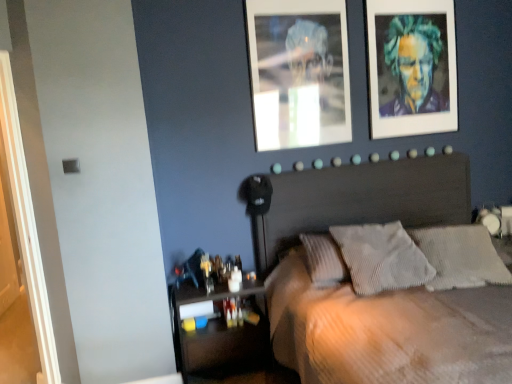
The width and height of the screenshot is (512, 384). Describe the element at coordinates (413, 65) in the screenshot. I see `multicolored textured portrait at upper right` at that location.

Describe the element at coordinates (461, 257) in the screenshot. I see `gray corduroy pillow at center, which is the 2th pillow from left to right` at that location.

Where is `translucent plastic shelf at lower left`? This screenshot has height=384, width=512. translucent plastic shelf at lower left is located at coordinates pos(218,331).

From a real-world perspective, relative to metallic silver photo frame at upper center, is wooden bed at center vertically above or below?

In terms of real-world spatial position, wooden bed at center is below metallic silver photo frame at upper center.

Does wooden bed at center have a greater width compared to metallic silver photo frame at upper center?

Yes, wooden bed at center is wider than metallic silver photo frame at upper center.

Consider the image. Considering the sizes of wooden bed at center and metallic silver photo frame at upper center in the image, is wooden bed at center taller or shorter than metallic silver photo frame at upper center?

Considering their sizes, wooden bed at center has more height than metallic silver photo frame at upper center.

The width and height of the screenshot is (512, 384). I want to click on bed on the right side of metallic silver photo frame at upper center, so click(x=384, y=333).

Does multicolored textured portrait at upper right turn towards white painted wood door at left?

No, multicolored textured portrait at upper right is not aimed at white painted wood door at left.

How many degrees apart are the facing directions of multicolored textured portrait at upper right and white painted wood door at left?

They differ by 45.5 degrees in their facing directions.

From a real-world perspective, who is located higher, multicolored textured portrait at upper right or white painted wood door at left?

multicolored textured portrait at upper right.

From the image's perspective, does multicolored textured portrait at upper right appear higher than white painted wood door at left?

Yes.

How much distance is there between multicolored textured portrait at upper right and gray corduroy pillow at center, which is the 2th pillow from left to right?

3.86 feet.

Is multicolored textured portrait at upper right oriented towards gray corduroy pillow at center, which is the 1th pillow from right to left?

No, multicolored textured portrait at upper right is not aimed at gray corduroy pillow at center, which is the 1th pillow from right to left.

Is multicolored textured portrait at upper right placed right next to gray corduroy pillow at center, which is the 1th pillow from right to left?

No, multicolored textured portrait at upper right is not touching gray corduroy pillow at center, which is the 1th pillow from right to left.

Is multicolored textured portrait at upper right positioned behind gray corduroy pillow at center, which is the 2th pillow from left to right?

That is True.

Based on the photo, who is bigger, white painted wood door at left or metallic silver photo frame at upper center?

Bigger between the two is white painted wood door at left.

Looking at this image, measure the distance between white painted wood door at left and metallic silver photo frame at upper center.

A distance of 1.72 meters exists between white painted wood door at left and metallic silver photo frame at upper center.

Between white painted wood door at left and metallic silver photo frame at upper center, which one is positioned in front?

white painted wood door at left is closer to the camera.

Considering the relative sizes of white painted wood door at left and metallic silver photo frame at upper center in the image provided, is white painted wood door at left thinner than metallic silver photo frame at upper center?

No.

Where is `bed located on the right of translucent plastic shelf at lower left`? This screenshot has width=512, height=384. bed located on the right of translucent plastic shelf at lower left is located at coordinates (384, 333).

Does translucent plastic shelf at lower left have a lesser width compared to wooden bed at center?

Yes.

Can you tell me how much translucent plastic shelf at lower left and wooden bed at center differ in facing direction?

They differ by 0.298 degrees in their facing directions.

Between translucent plastic shelf at lower left and wooden bed at center, which one has smaller size?

translucent plastic shelf at lower left is smaller.

Is point (25, 268) positioned behind point (441, 286)?

Yes, it is behind point (441, 286).

Where is `the 2nd pillow counting from the right side of the white painted wood door at left`? The image size is (512, 384). the 2nd pillow counting from the right side of the white painted wood door at left is located at coordinates [x=461, y=257].

Which object is closer to the camera, white painted wood door at left or gray corduroy pillow at center, which is the 2th pillow from left to right?

white painted wood door at left is closer to the camera.

From a real-world perspective, does gray corduroy pillow at center, which is the 2th pillow from left to right, stand above white painted wood door at left?

Actually, gray corduroy pillow at center, which is the 2th pillow from left to right, is physically below white painted wood door at left in the real world.

Is gray corduroy pillow at center, which is the 2th pillow from left to right, wider than white painted wood door at left?

Correct, the width of gray corduroy pillow at center, which is the 2th pillow from left to right, exceeds that of white painted wood door at left.

Considering the relative sizes of gray corduroy pillow at center, which is the 2th pillow from left to right, and white painted wood door at left in the image provided, is gray corduroy pillow at center, which is the 2th pillow from left to right, smaller than white painted wood door at left?

Yes, gray corduroy pillow at center, which is the 2th pillow from left to right, is smaller than white painted wood door at left.

From the image's perspective, is gray corduroy pillow at center, which is the 1th pillow from right to left, positioned above or below white painted wood door at left?

Clearly, from the image's perspective, gray corduroy pillow at center, which is the 1th pillow from right to left, is below white painted wood door at left.

This screenshot has width=512, height=384. In order to click on bed below the metallic silver photo frame at upper center (from the image's perspective) in this screenshot , I will do `click(384, 333)`.

Find the location of a particular element. The height and width of the screenshot is (384, 512). door that appears on the left of multicolored textured portrait at upper right is located at coordinates (26, 224).

When comparing their distances from translucent plastic shelf at lower left, does white painted wood door at left or multicolored textured portrait at upper right seem further?

multicolored textured portrait at upper right.

Looking at this image, based on their spatial positions, is wooden bed at center or white painted wood door at left further from translucent plastic shelf at lower left?

white painted wood door at left lies further to translucent plastic shelf at lower left than the other object.

Which object lies further to the anchor point translucent plastic shelf at lower left, gray corduroy pillow at center, which is the 1th pillow from right to left, or gray corduroy pillow at center, which is the second pillow from right to left?

The object further to translucent plastic shelf at lower left is gray corduroy pillow at center, which is the 1th pillow from right to left.

Looking at the image, which one is located further to metallic silver photo frame at upper center, gray corduroy pillow at center, which ranks as the first pillow in left-to-right order, or white painted wood door at left?

white painted wood door at left lies further to metallic silver photo frame at upper center than the other object.

When comparing their distances from gray corduroy pillow at center, which is the second pillow from right to left, does white painted wood door at left or gray corduroy pillow at center, which is the 2th pillow from left to right, seem closer?

gray corduroy pillow at center, which is the 2th pillow from left to right, is positioned closer to the anchor gray corduroy pillow at center, which is the second pillow from right to left.

In the scene shown: From the image, which object appears to be farther from white painted wood door at left, wooden bed at center or gray corduroy pillow at center, which ranks as the first pillow in left-to-right order?

gray corduroy pillow at center, which ranks as the first pillow in left-to-right order, lies further to white painted wood door at left than the other object.

From the image, which object appears to be farther from metallic silver photo frame at upper center, wooden bed at center or white painted wood door at left?

Based on the image, white painted wood door at left appears to be further to metallic silver photo frame at upper center.

From the image, which object appears to be farther from white painted wood door at left, metallic silver photo frame at upper center or gray corduroy pillow at center, which is the 1th pillow from right to left?

Among the two, gray corduroy pillow at center, which is the 1th pillow from right to left, is located further to white painted wood door at left.

Find the location of a particular element. pillow between white painted wood door at left and gray corduroy pillow at center, which is the 2th pillow from left to right is located at coordinates (381, 257).

The width and height of the screenshot is (512, 384). Find the location of `person between white painted wood door at left and gray corduroy pillow at center, which is the 1th pillow from right to left, from left to right`. person between white painted wood door at left and gray corduroy pillow at center, which is the 1th pillow from right to left, from left to right is located at coordinates (413, 65).

In order to click on pillow between wooden bed at center and gray corduroy pillow at center, which ranks as the first pillow in left-to-right order, from front to back in this screenshot , I will do `click(461, 257)`.

Image resolution: width=512 pixels, height=384 pixels. Identify the location of pillow between translucent plastic shelf at lower left and gray corduroy pillow at center, which is the 1th pillow from right to left. (381, 257).